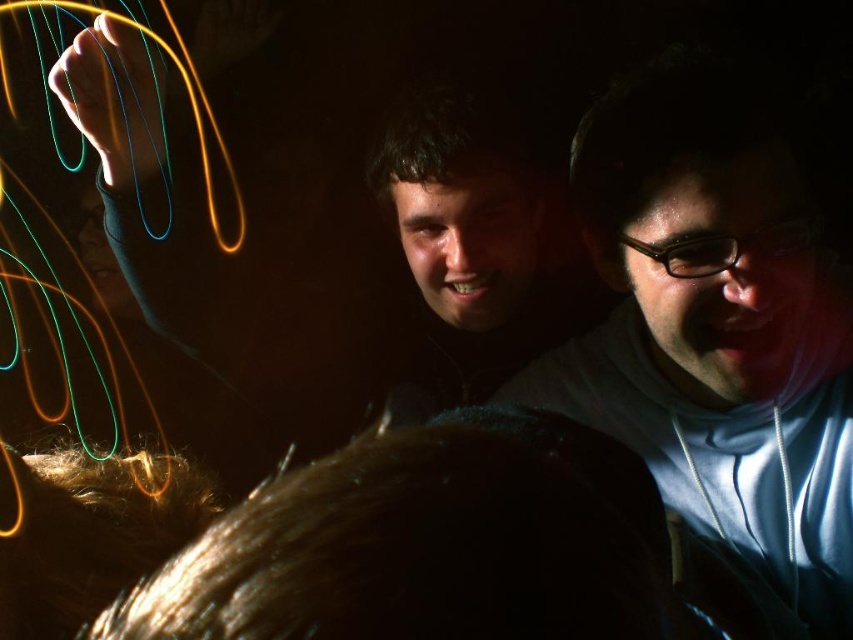
Question: Does matte white hoodie at center right come behind matte black face at center?

Choices:
 (A) no
 (B) yes

Answer: (A)

Question: Which point is farther to the camera?

Choices:
 (A) (715, 182)
 (B) (569, 298)

Answer: (B)

Question: Is matte white hoodie at center right further to camera compared to matte black face at center?

Choices:
 (A) yes
 (B) no

Answer: (B)

Question: Observing the image, what is the correct spatial positioning of matte white hoodie at center right in reference to matte black face at center?

Choices:
 (A) left
 (B) right

Answer: (B)